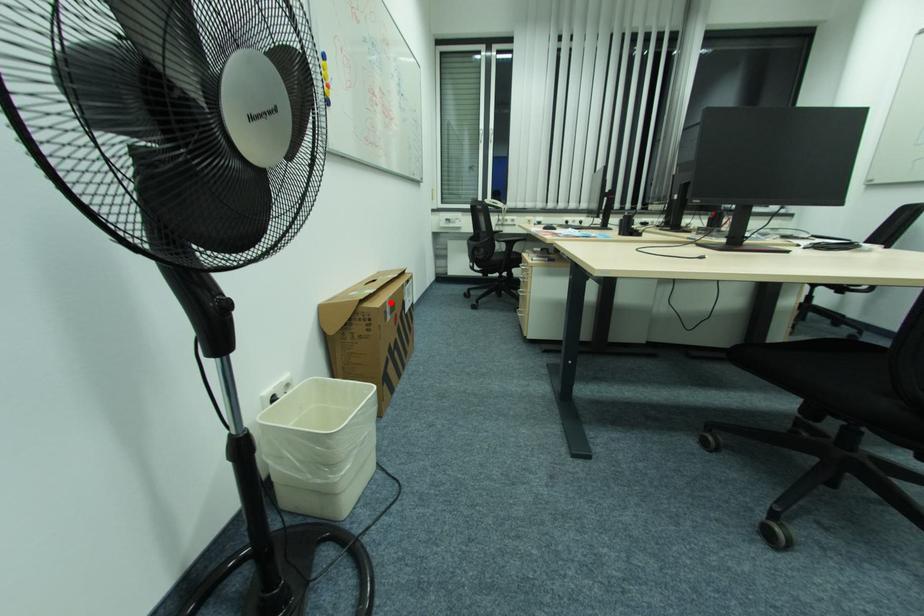
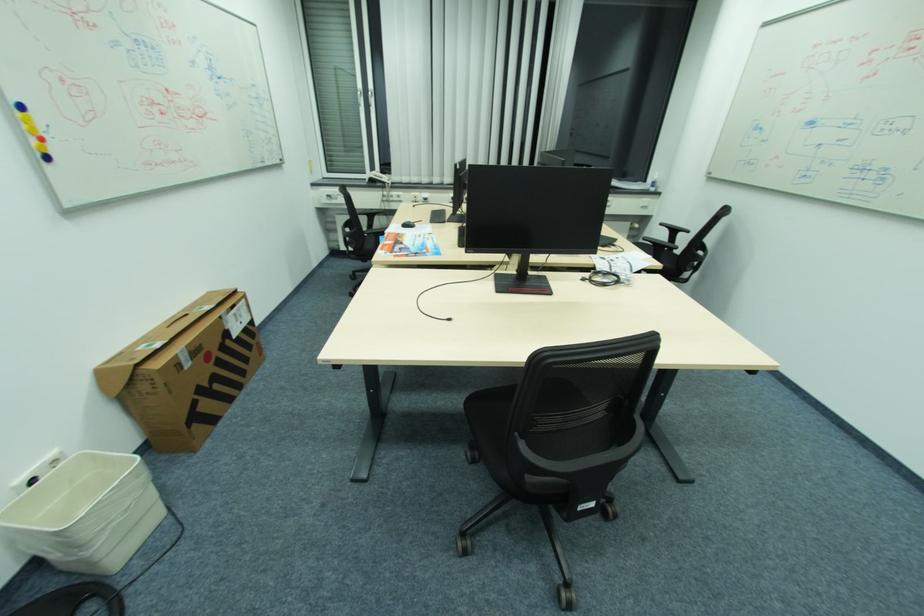
The point at the highlighted location is marked in the first image. Where is the corresponding point in the second image?

(181, 355)